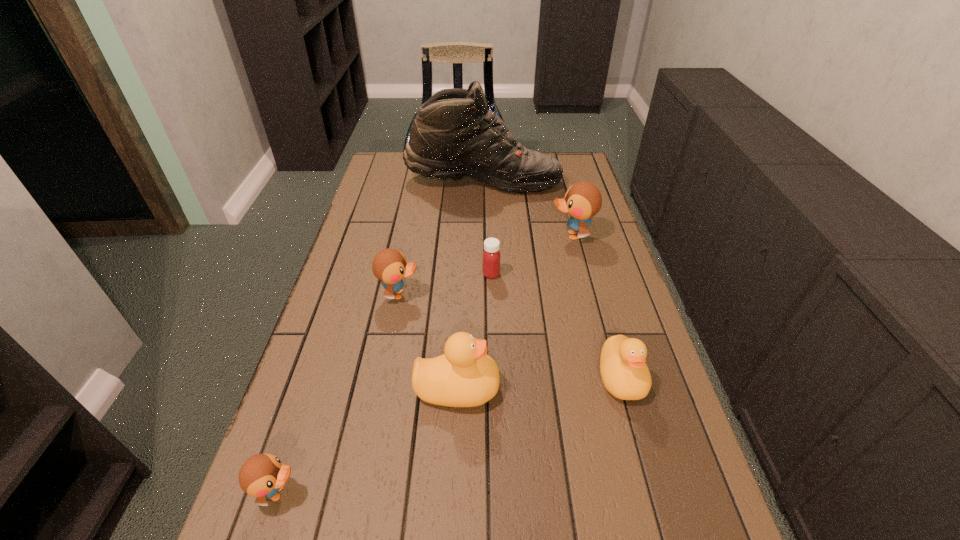
Locate an element on the screen. object that is the closest one to the smaller yellow duck is located at coordinates (464, 376).

Find the location of a particular element. The width and height of the screenshot is (960, 540). object identified as the third closest to the second nearest blue duck is located at coordinates (583, 200).

I want to click on the third closest duck relative to the fifth nearest object, so click(464, 376).

The image size is (960, 540). I want to click on duck identified as the closest to the farthest duck, so click(x=625, y=375).

Find the location of a particular element. blue duck that is the third closest one to the tallest object is located at coordinates (262, 475).

Identify which blue duck is the third nearest to the third duck from right to left. Please provide its 2D coordinates. Your answer should be formatted as a tuple, i.e. [(x, y)], where the tuple contains the x and y coordinates of a point satisfying the conditions above.

[(583, 200)]

The height and width of the screenshot is (540, 960). What are the coordinates of `the second closest yellow duck relative to the medicine` in the screenshot? It's located at (625, 375).

Find the location of a particular element. The image size is (960, 540). vacant area that satisfies the following two spatial constraints: 1. on the face of the smaller yellow duck; 2. on the face of the third duck from left to right is located at coordinates (624, 388).

Locate an element on the screen. free location that satisfies the following two spatial constraints: 1. on the front side of the tallest object; 2. on the left side of the medicine is located at coordinates click(484, 274).

Find the location of a particular element. free location that satisfies the following two spatial constraints: 1. on the front side of the ski boot; 2. on the face of the bigger yellow duck is located at coordinates (485, 388).